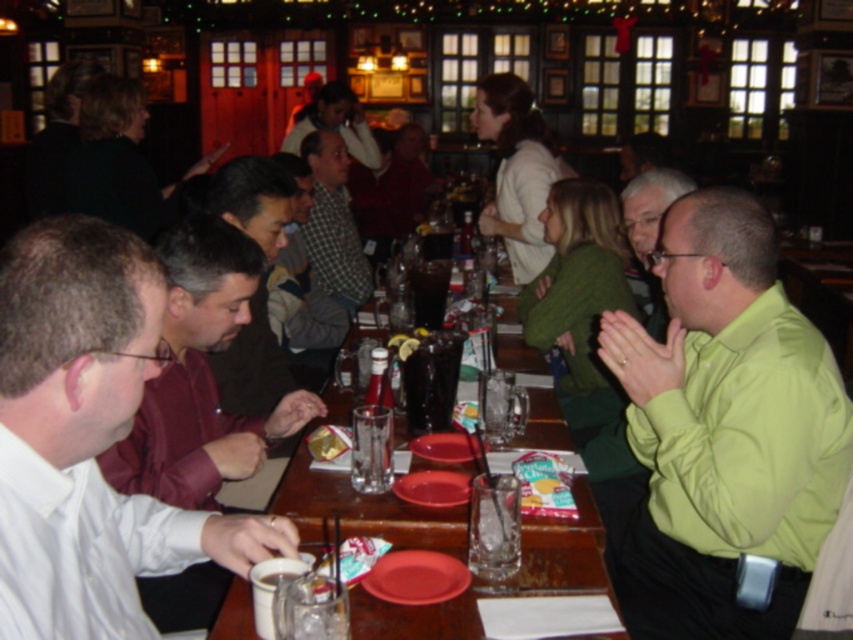
Question: Which object is farther from the camera taking this photo?

Choices:
 (A) wooden table at center
 (B) translucent glass cup at center
 (C) green smooth shirt at right

Answer: (B)

Question: Which point is farther to the camera?

Choices:
 (A) (405, 408)
 (B) (320, 202)
 (C) (439, 326)

Answer: (B)

Question: Can you confirm if maroon shirt at left is positioned to the right of green checkered shirt at center?

Choices:
 (A) yes
 (B) no

Answer: (A)

Question: Is green checkered shirt at center wider than black glass pitcher at center?

Choices:
 (A) yes
 (B) no

Answer: (A)

Question: Does wooden table at center appear on the right side of black glass pitcher at center?

Choices:
 (A) no
 (B) yes

Answer: (B)

Question: Which point appears farthest from the camera in this image?

Choices:
 (A) (418, 284)
 (B) (408, 360)

Answer: (A)